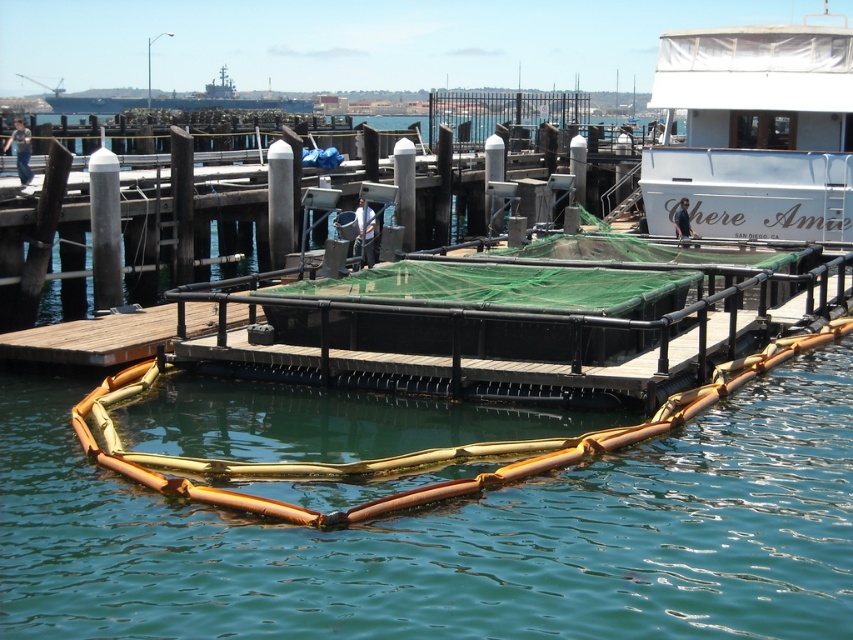
Question: Does brown rubber barrier at center have a larger size compared to white matte boat at upper right?

Choices:
 (A) no
 (B) yes

Answer: (B)

Question: Is brown rubber barrier at center wider than white matte boat at upper right?

Choices:
 (A) no
 (B) yes

Answer: (B)

Question: Observing the image, what is the correct spatial positioning of brown rubber barrier at center in reference to white matte boat at upper right?

Choices:
 (A) left
 (B) right

Answer: (A)

Question: Which point is farther to the camera?

Choices:
 (A) (495, 432)
 (B) (724, 230)

Answer: (B)

Question: Which object is farther from the camera taking this photo?

Choices:
 (A) white matte boat at upper right
 (B) brown rubber barrier at center

Answer: (A)